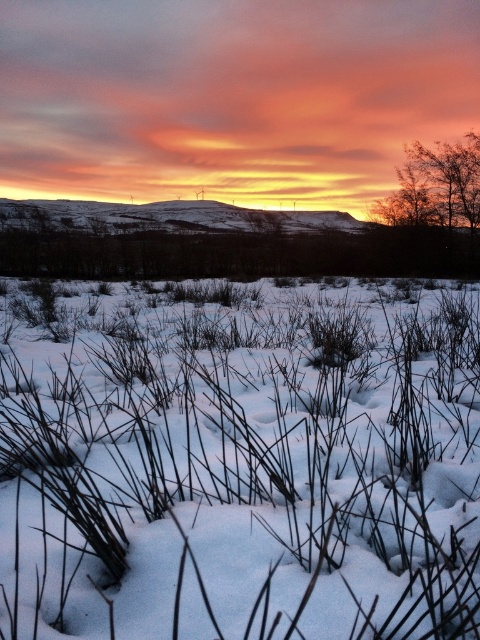
From the picture: You are a photographer planning to capture the winter landscape. You want to ensure that both the brown dry grass at lower center and the brown textured tree at upper right are clearly visible in your shot. Given their heights, which object will appear closer to the camera in the final photograph?

The brown dry grass at lower center is shorter than the brown textured tree at upper right, so the brown dry grass at lower center will appear closer to the camera in the photograph because shorter objects in the foreground are typically closer to the viewer.